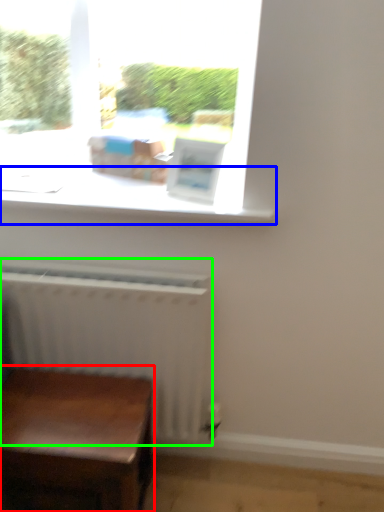
Question: Which object is the farthest from table (highlighted by a red box)? Choose among these: window sill (highlighted by a blue box) or radiator (highlighted by a green box).

Choices:
 (A) window sill
 (B) radiator

Answer: (A)